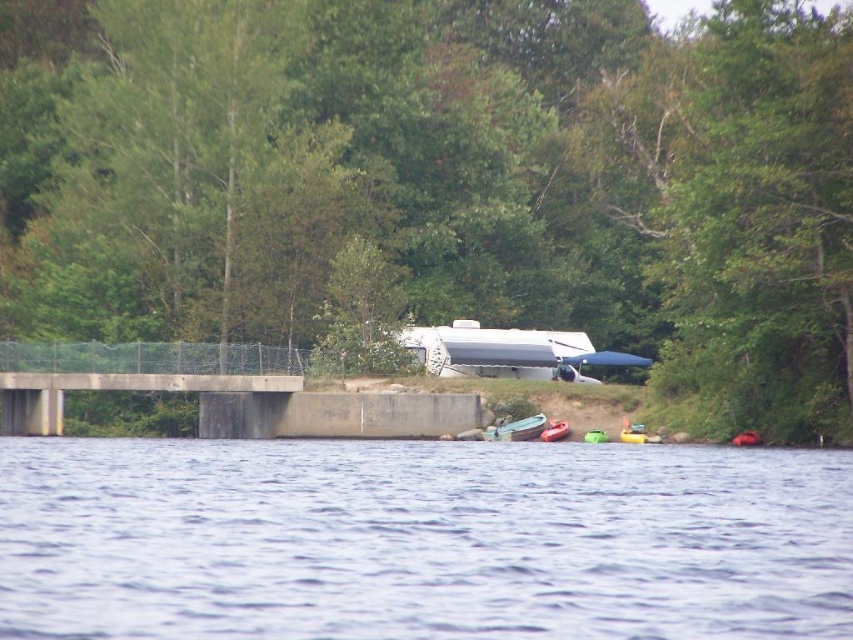
Between metallic blue kayak at lower center and green rubber boat at lower center, which one is positioned lower?

Positioned lower is green rubber boat at lower center.

In order to click on metallic blue kayak at lower center in this screenshot , I will do `click(515, 429)`.

What do you see at coordinates (515, 429) in the screenshot? The image size is (853, 640). I see `metallic blue kayak at lower center` at bounding box center [515, 429].

Find the location of a particular element. The height and width of the screenshot is (640, 853). metallic blue kayak at lower center is located at coordinates (515, 429).

Can you confirm if transparent water at center is taller than metallic blue kayak at lower center?

Yes, transparent water at center is taller than metallic blue kayak at lower center.

Between transparent water at center and metallic blue kayak at lower center, which one is positioned higher?

transparent water at center

Image resolution: width=853 pixels, height=640 pixels. Identify the location of transparent water at center. (421, 540).

Is transparent water at center to the right of green rubber boat at lower center from the viewer's perspective?

Incorrect, transparent water at center is not on the right side of green rubber boat at lower center.

Which is behind, point (0, 536) or point (556, 422)?

The point (556, 422) is behind.

The image size is (853, 640). Identify the location of transparent water at center. (x=421, y=540).